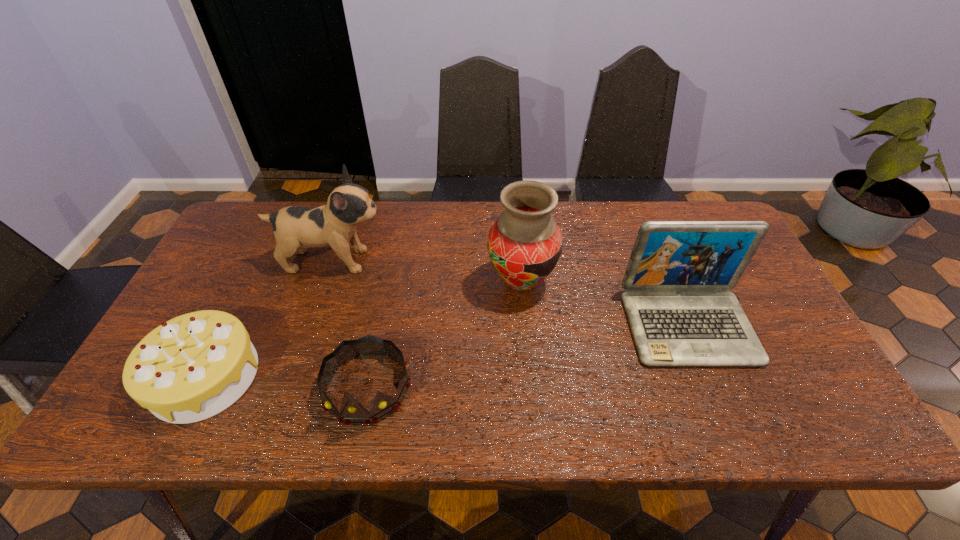
At what (x,y) coordinates should I click in order to perform the action: click on the third closest object to the tiara. Please return your answer as a coordinate pair (x, y). Looking at the image, I should click on (295, 228).

You are a GUI agent. You are given a task and a screenshot of the screen. Output one action in this format:
    pyautogui.click(x=<x>, y=<y>)
    Task: Click on the vacant space that satisfies the following two spatial constraints: 1. at the face of the puppy; 2. on the front side of the birthday cake
    The height and width of the screenshot is (540, 960).
    Given the screenshot: What is the action you would take?
    pyautogui.click(x=294, y=376)